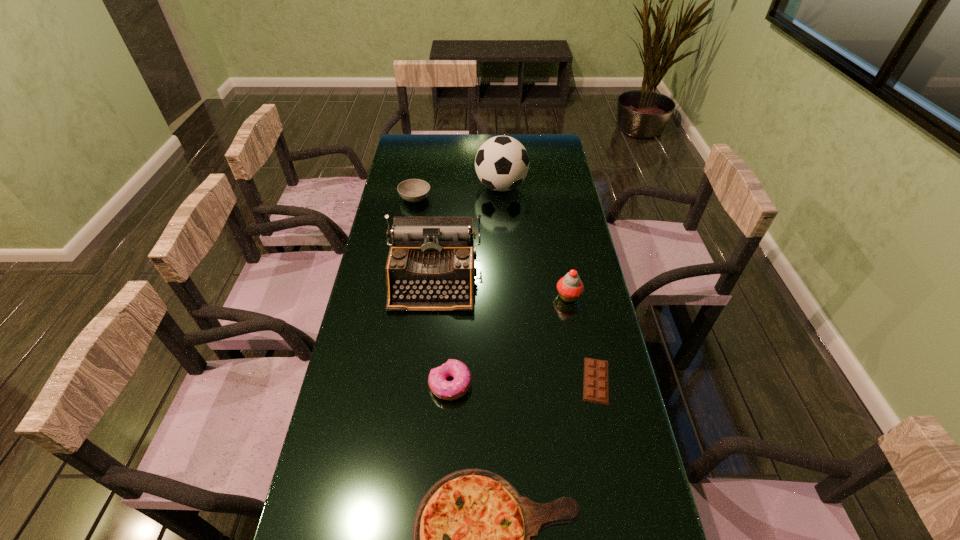
In order to click on free space that satisfies the following two spatial constraints: 1. on the keyboard of the typewriter; 2. on the right side of the fifth shortest object in this screenshot , I will do `click(432, 296)`.